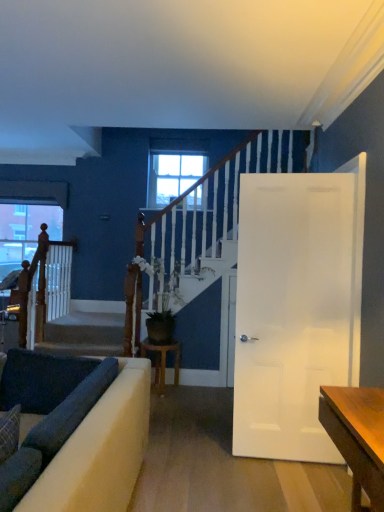
Identify the location of free location to the right of wooden stool at center. click(191, 396).